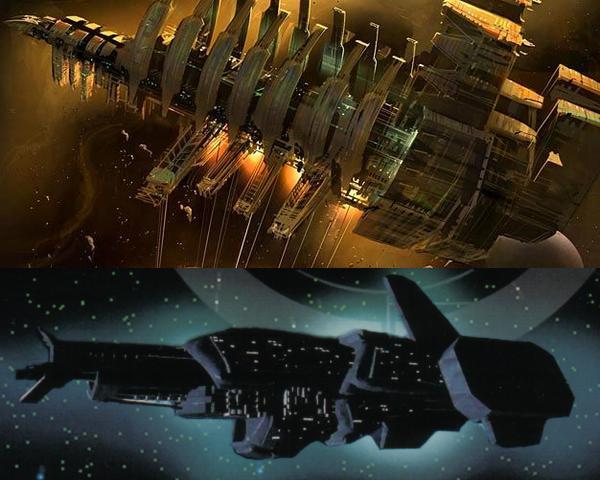
At what (x,y) coordinates should I click in order to perform the action: click on yellow lights. Please return your answer as a coordinate pair (x, y). The height and width of the screenshot is (480, 600). Looking at the image, I should click on (349, 216).